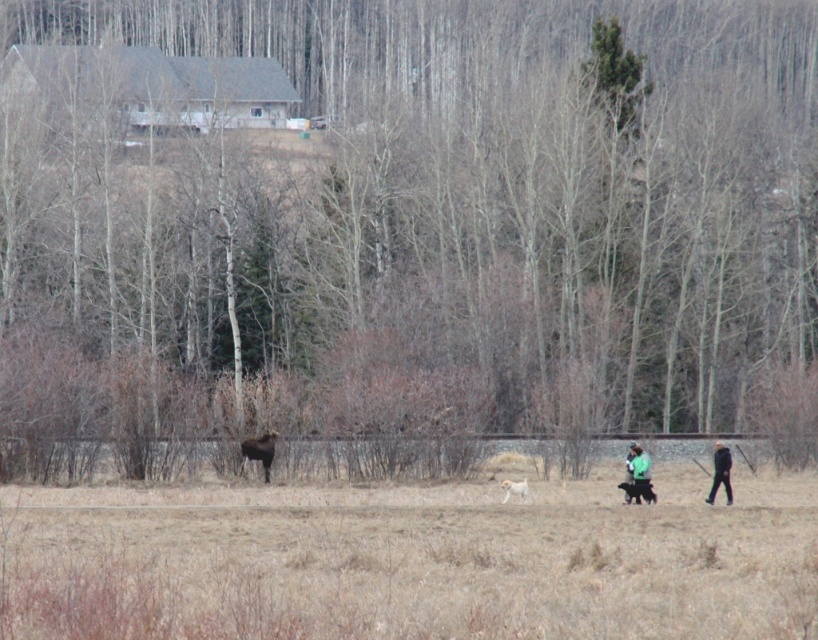
Is brown grass at center wider than black fur dog at lower right?

Yes.

Find the location of a particular element. brown grass at center is located at coordinates (409, 563).

Where is `brown grass at center`? This screenshot has height=640, width=818. brown grass at center is located at coordinates (409, 563).

Is brown textured tree at lower center to the right of green fabric jacket at lower right from the viewer's perspective?

In fact, brown textured tree at lower center is to the left of green fabric jacket at lower right.

Between point (88, 321) and point (636, 490), which one is positioned in front?

Positioned in front is point (636, 490).

Where is `brown textured tree at lower center`? This screenshot has width=818, height=640. brown textured tree at lower center is located at coordinates (425, 193).

Is green fabric jacket at lower right to the left of black fabric jacket at lower right from the viewer's perspective?

Indeed, green fabric jacket at lower right is positioned on the left side of black fabric jacket at lower right.

Does green fabric jacket at lower right have a smaller size compared to black fabric jacket at lower right?

Yes, green fabric jacket at lower right is smaller than black fabric jacket at lower right.

Does point (649, 480) come closer to viewer compared to point (713, 444)?

That is True.

The image size is (818, 640). In order to click on green fabric jacket at lower right in this screenshot , I will do `click(639, 476)`.